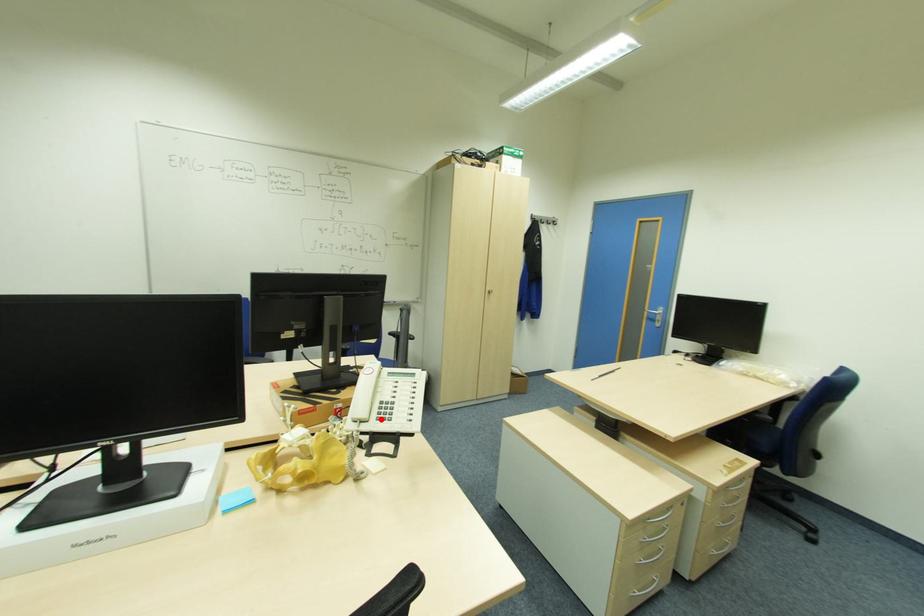
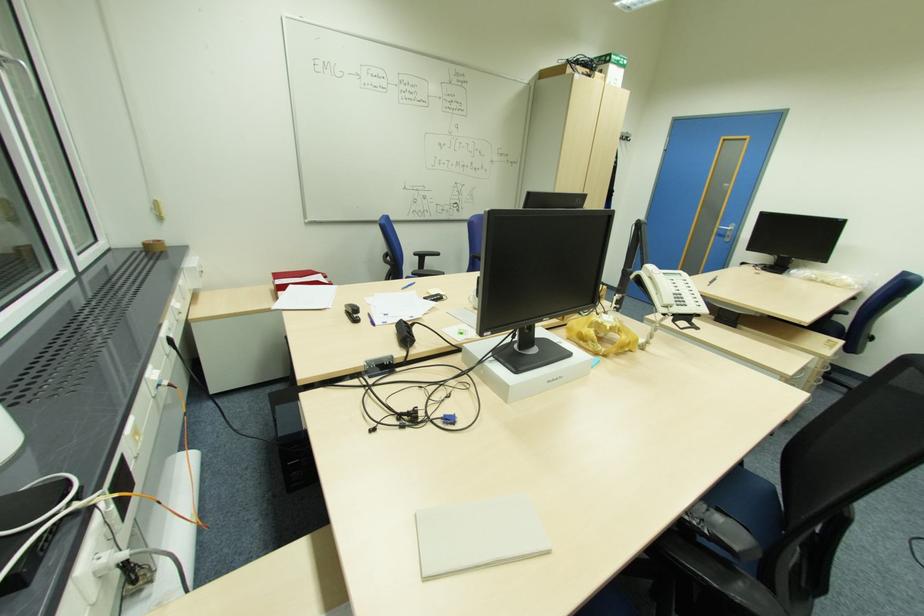
Find the pixel in the second image that matches the highlighted location in the first image.

(681, 305)